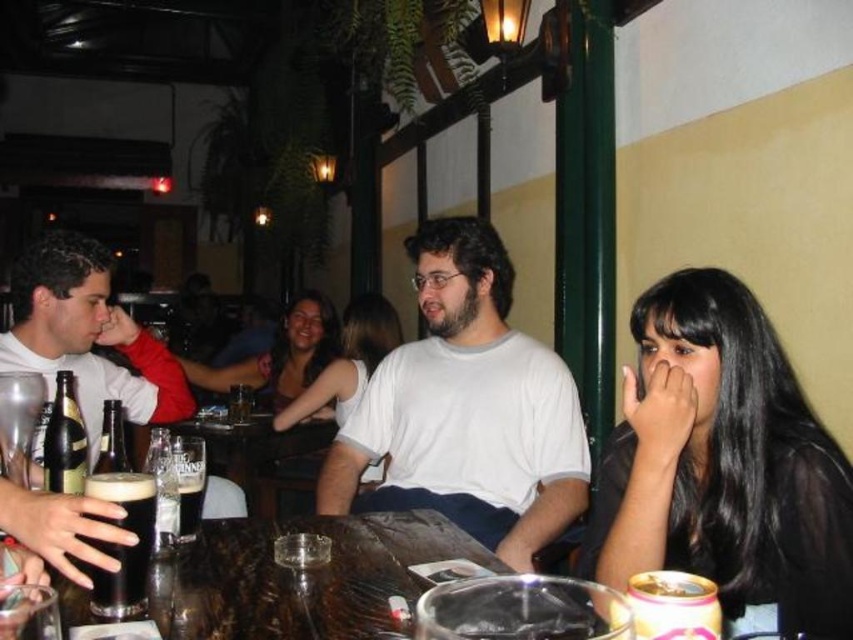
Can you confirm if translucent glass beer at center is positioned below gold metallic can at lower right?

Yes.

Is translucent glass beer at center further to camera compared to gold metallic can at lower right?

Yes, it is behind gold metallic can at lower right.

Is point (212, 465) closer to camera compared to point (654, 612)?

No, (212, 465) is further to viewer.

You are a GUI agent. You are given a task and a screenshot of the screen. Output one action in this format:
    pyautogui.click(x=<x>, y=<y>)
    Task: Click on the translucent glass beer at center
    This screenshot has width=853, height=640.
    Given the screenshot: What is the action you would take?
    (257, 456)

Between matte black shirt at left and smooth white tank top at center, which one has more height?

With more height is matte black shirt at left.

Does matte black shirt at left appear under smooth white tank top at center?

No.

Who is more distant from viewer, (167, 392) or (339, 419)?

Point (339, 419)

Identify the location of matte black shirt at left. (88, 337).

Is white matte shirt at center positioned at the back of dark matte glass at table center?

Yes, white matte shirt at center is behind dark matte glass at table center.

Who is lower down, white matte shirt at center or dark matte glass at table center?

dark matte glass at table center

Does point (410, 481) lie in front of point (103, 545)?

No.

This screenshot has height=640, width=853. Find the location of `white matte shirt at center`. white matte shirt at center is located at coordinates (467, 408).